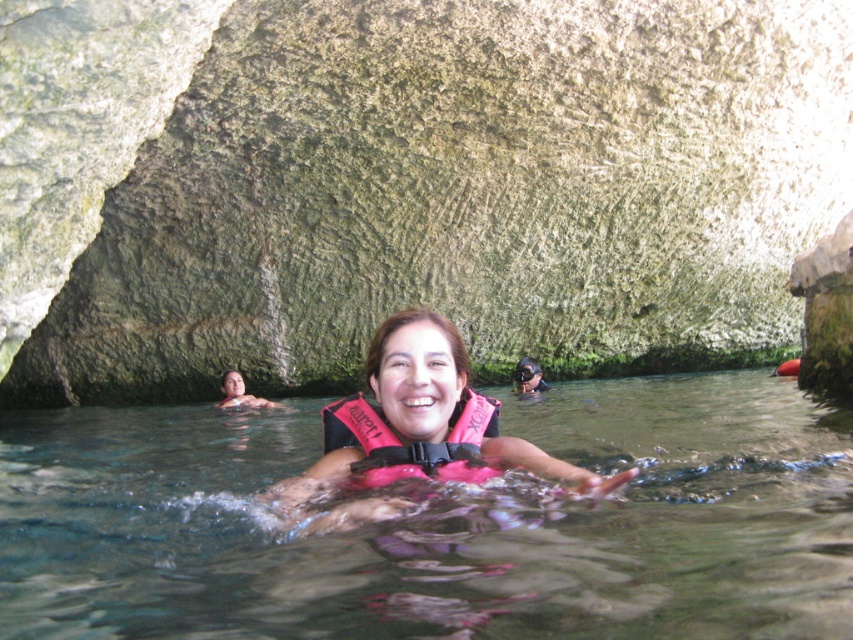
You are a lifeguard at the pool and need to determine which life preserver is wider. You see the pink life vest at center and the pink fabric life jacket at center. Which one is wider?

The pink life vest at center is wider than the pink fabric life jacket at center.

Consider the image. You are standing at the edge of the natural pool and want to swim to the clear water at center marked by point (439, 524). The woman in the red life vest with the word ROBERT is swimming towards that point. Do you think you can reach the clear water at center before her?

The point (439, 524) marks clear water at center, but the woman in the red life vest with the word ROBERT is already swimming towards it. Whether you can reach it before her depends on your swimming speed compared to hers. The scene does not provide information about their speeds, so it is impossible to determine who will arrive first.